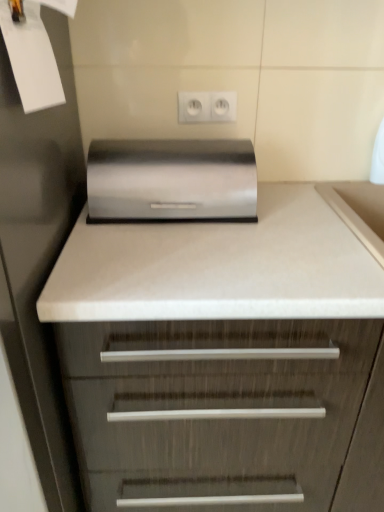
You are a GUI agent. You are given a task and a screenshot of the screen. Output one action in this format:
    pyautogui.click(x=<x>, y=<y>)
    Task: Click on the vacant space to the right of satin metallic breadbox at center
    This screenshot has width=384, height=512.
    Given the screenshot: What is the action you would take?
    pyautogui.click(x=303, y=220)